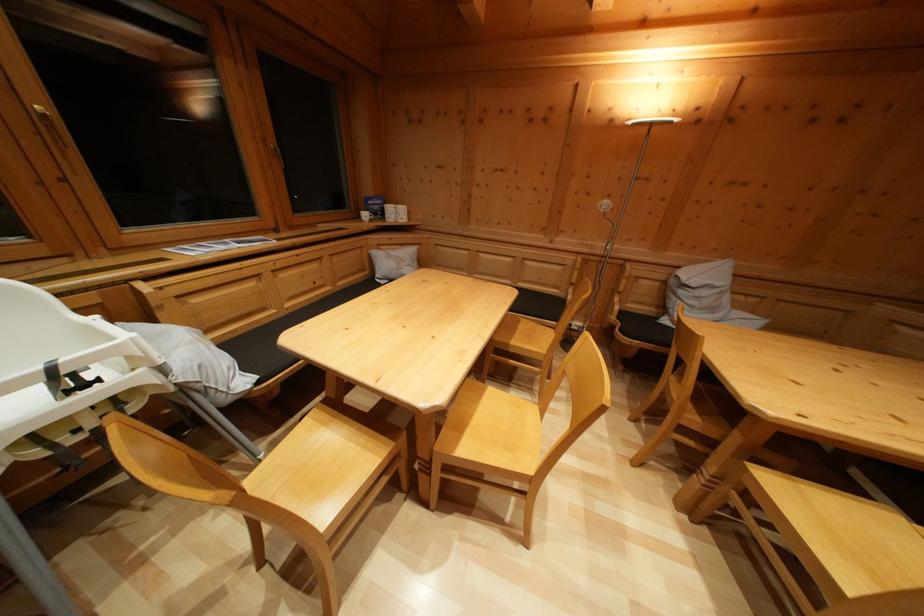
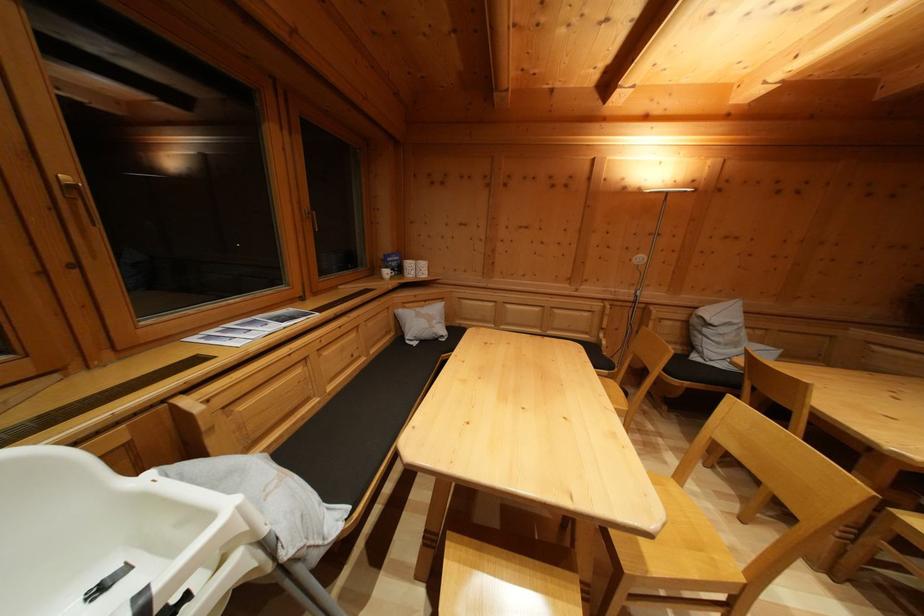
Find the pixel in the second image that matches point (687, 299) in the first image.

(711, 337)